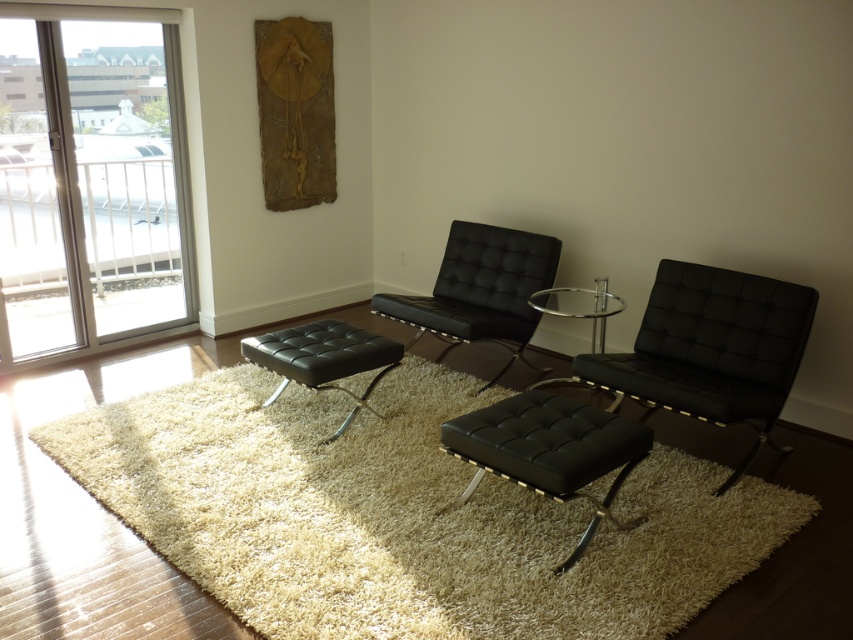
Question: Is transparent glass door at left bigger than transparent glass table at center?

Choices:
 (A) no
 (B) yes

Answer: (B)

Question: Which of the following is the closest to the observer?

Choices:
 (A) black leather ottoman at center
 (B) transparent glass table at center
 (C) black leather armchair at center
 (D) black leather armchair at right

Answer: (D)

Question: In this image, where is black leather stool at center located relative to black leather ottoman at center?

Choices:
 (A) right
 (B) left

Answer: (A)

Question: Which point is farther to the camera?

Choices:
 (A) (36, 211)
 (B) (604, 300)

Answer: (A)

Question: Which object appears farthest from the camera in this image?

Choices:
 (A) transparent glass table at center
 (B) transparent glass door at left
 (C) black leather armchair at center
 (D) black leather stool at center

Answer: (C)

Question: Is black leather armchair at right above black leather stool at center?

Choices:
 (A) no
 (B) yes

Answer: (B)